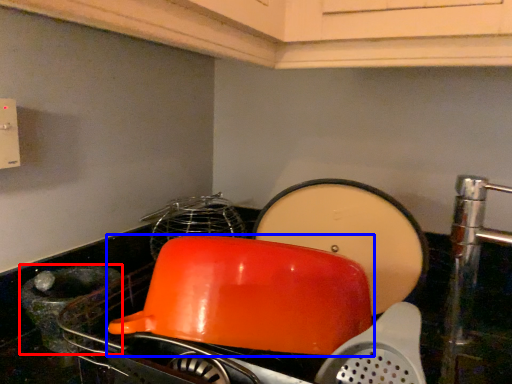
Question: Which object is further to the camera taking this photo, appliance (highlighted by a red box) or kitchen appliance (highlighted by a blue box)?

Choices:
 (A) appliance
 (B) kitchen appliance

Answer: (A)